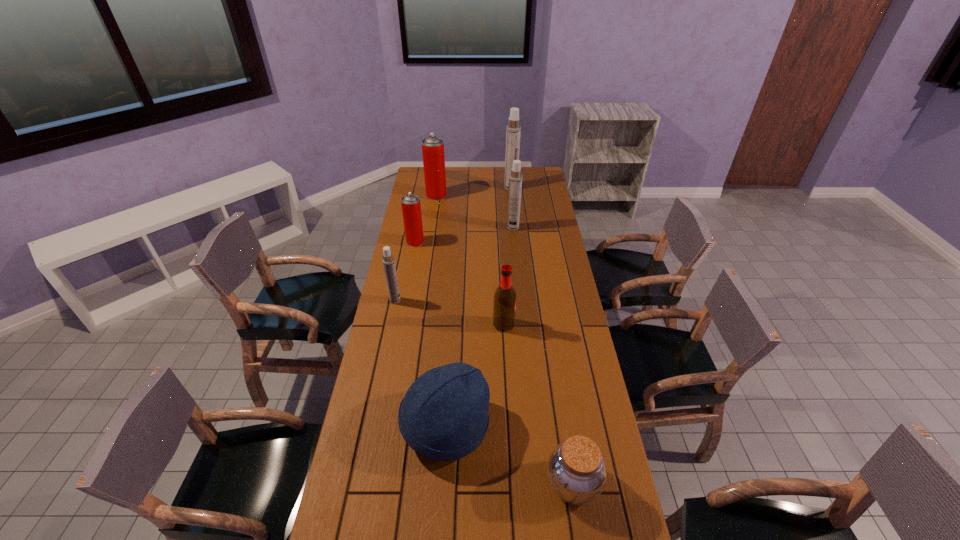
Where is `the tallest aerosol can`? This screenshot has height=540, width=960. the tallest aerosol can is located at coordinates (513, 132).

The image size is (960, 540). Identify the location of the biggest white aerosol can. (513, 132).

At what (x,y) coordinates should I click in order to perform the action: click on the bigger red aerosol can. Please return your answer as a coordinate pair (x, y). Looking at the image, I should click on (432, 147).

This screenshot has height=540, width=960. I want to click on the second farthest white aerosol can, so click(515, 179).

Find the location of `the seventh nearest object`. the seventh nearest object is located at coordinates (515, 179).

The width and height of the screenshot is (960, 540). Identify the location of beer bottle. click(504, 307).

Where is `the fourth object from right to left`? The image size is (960, 540). the fourth object from right to left is located at coordinates (504, 307).

Image resolution: width=960 pixels, height=540 pixels. Identify the location of the smaller red aerosol can. (411, 209).

Where is `the nearer red aerosol can`? Image resolution: width=960 pixels, height=540 pixels. the nearer red aerosol can is located at coordinates (411, 209).

This screenshot has height=540, width=960. Find the location of `the fifth nearest object`. the fifth nearest object is located at coordinates (388, 261).